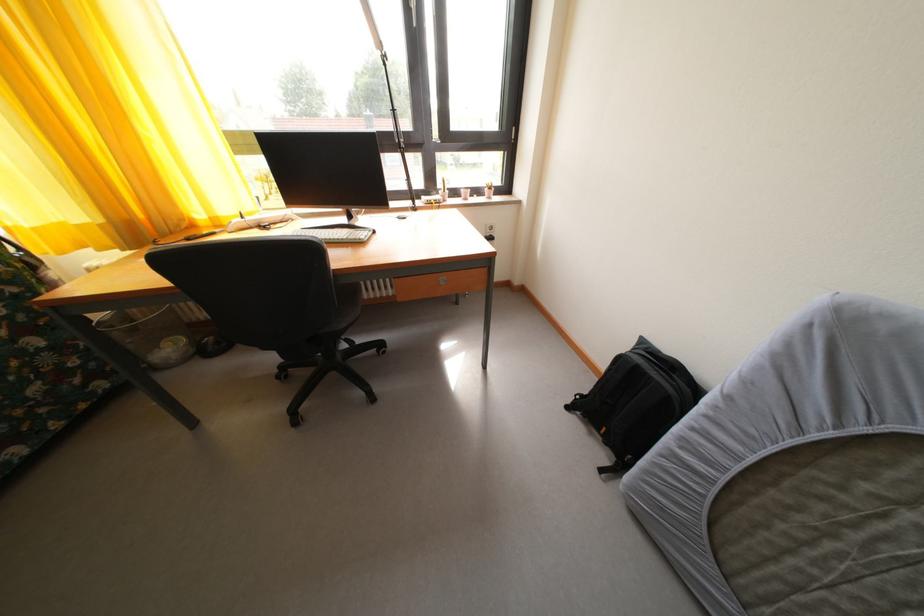
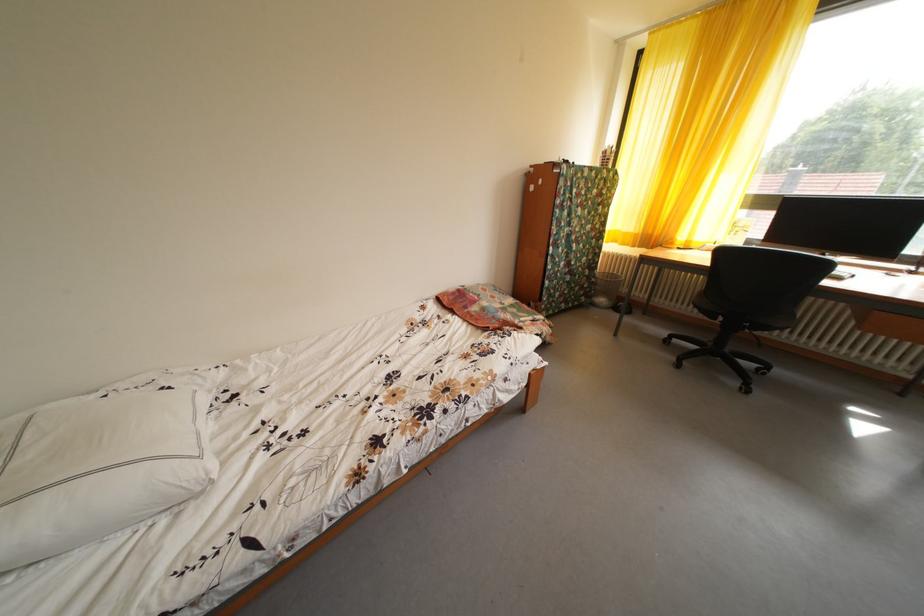
The point at (83, 370) is marked in the first image. Where is the corresponding point in the second image?

(594, 292)